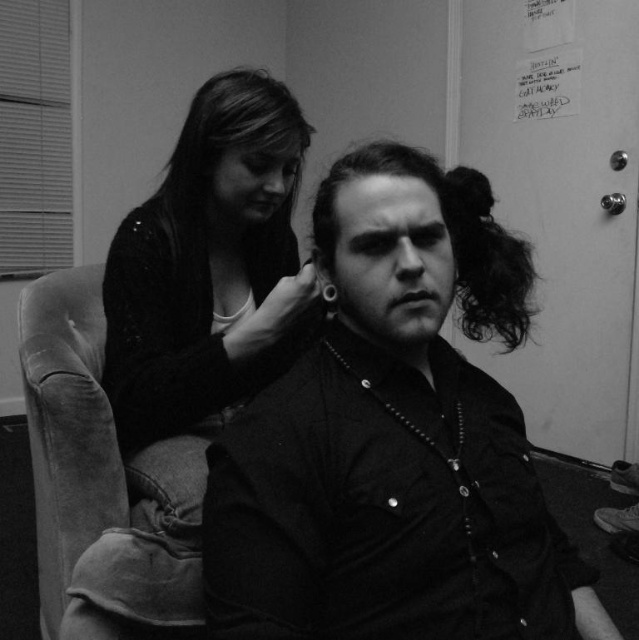
Who is more forward, (456,561) or (194,272)?

Point (456,561) is more forward.

The height and width of the screenshot is (640, 639). What do you see at coordinates (394, 440) in the screenshot? I see `matte black shirt at center` at bounding box center [394, 440].

What are the coordinates of `matte black shirt at center` in the screenshot? It's located at (394, 440).

Does matte black shirt at center lie behind dark curly hair at center?

No, it is not.

Is matte black shirt at center positioned in front of dark curly hair at center?

Yes, it is.

Describe the element at coordinates (394, 440) in the screenshot. I see `matte black shirt at center` at that location.

Identify the location of matte black shirt at center. The width and height of the screenshot is (639, 640). (394, 440).

Can you confirm if matte black sweater at upper left is positioned below dark curly hair at center?

Correct, matte black sweater at upper left is located below dark curly hair at center.

Who is positioned more to the right, matte black sweater at upper left or dark curly hair at center?

dark curly hair at center is more to the right.

The height and width of the screenshot is (640, 639). What do you see at coordinates (210, 266) in the screenshot?
I see `matte black sweater at upper left` at bounding box center [210, 266].

Image resolution: width=639 pixels, height=640 pixels. In order to click on matte black sweater at upper left in this screenshot , I will do `click(210, 266)`.